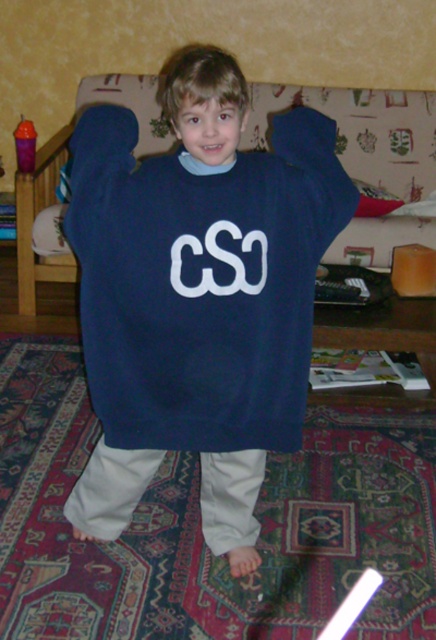
Looking at this image, the child is wearing a navy blue sweater at center and has a white matte cso at center. Which item is closer to you?

The navy blue sweater at center is closer to the viewer than the white matte cso at center.

The child is wearing a navy blue sweater at center and a white matte cso at center. Which one is positioned lower on the child?

The navy blue sweater at center is located below the white matte cso at center, so the navy blue sweater at center is positioned lower on the child.